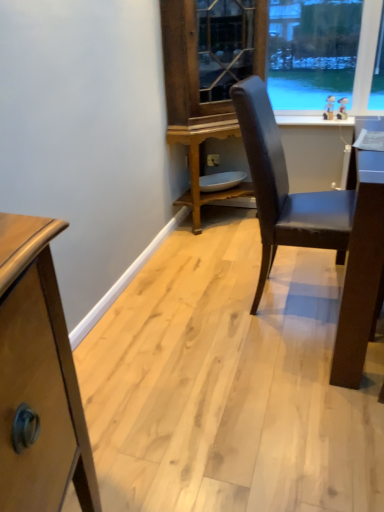
Image resolution: width=384 pixels, height=512 pixels. I want to click on free spot above white glossy window sill at upper right (from a real-world perspective), so click(312, 120).